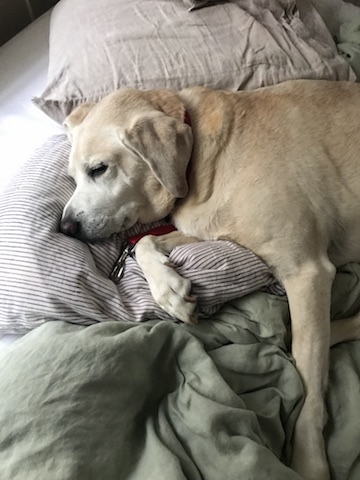
Identify the location of mattress. (29, 72).